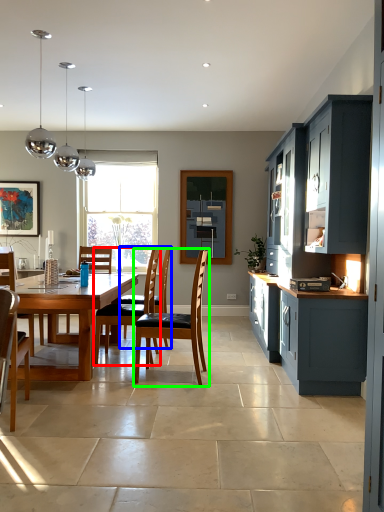
Question: Based on their relative distances, which object is farther from chair (highlighted by a red box)? Choose from armchair (highlighted by a blue box) and chair (highlighted by a green box).

Choices:
 (A) armchair
 (B) chair

Answer: (B)